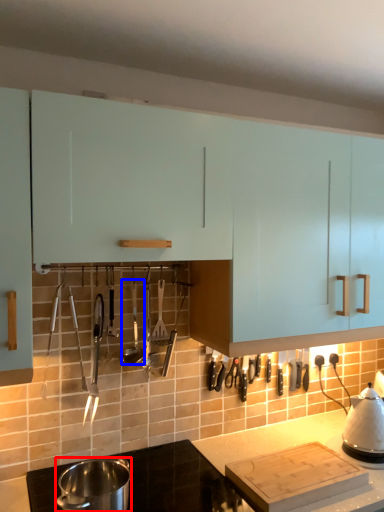
Question: Which of the following is the farthest to the observer, kitchen appliance (highlighted by a red box) or silverware (highlighted by a blue box)?

Choices:
 (A) kitchen appliance
 (B) silverware

Answer: (B)